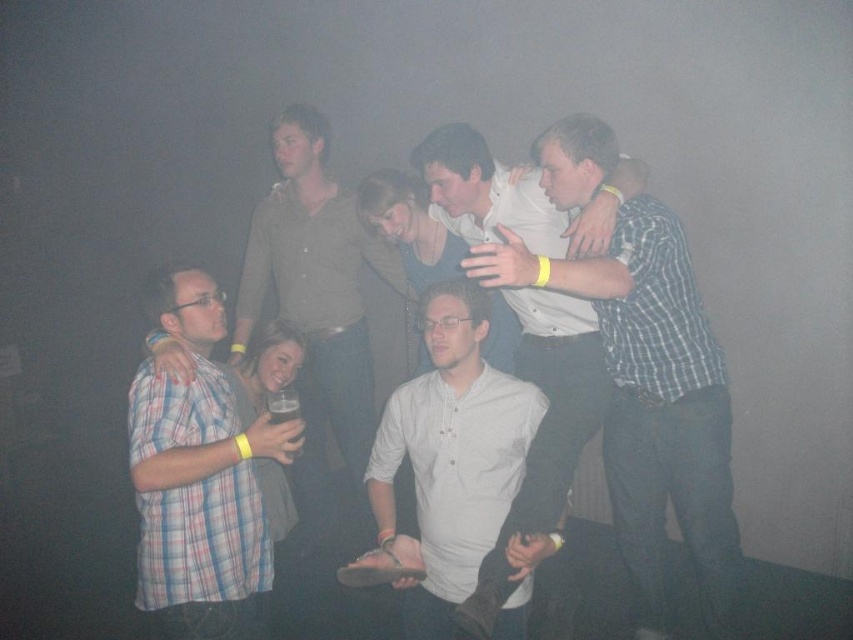
The width and height of the screenshot is (853, 640). What do you see at coordinates (651, 403) in the screenshot? I see `checkered fabric shirt at center` at bounding box center [651, 403].

How distant is checkered fabric shirt at center from plaid shirt at left?

They are 38.81 inches apart.

Which is behind, point (601, 317) or point (241, 612)?

Positioned behind is point (601, 317).

Where is `checkered fabric shirt at center`? The height and width of the screenshot is (640, 853). checkered fabric shirt at center is located at coordinates (651, 403).

Does point (183, 524) come in front of point (482, 452)?

Yes, it is in front of point (482, 452).

Find the location of `plaid shirt at left`. plaid shirt at left is located at coordinates (199, 480).

Who is positioned more to the left, checkered fabric shirt at center or white matte shirt at center?

From the viewer's perspective, white matte shirt at center appears more on the left side.

Is checkered fabric shirt at center above white matte shirt at center?

No, checkered fabric shirt at center is not above white matte shirt at center.

Looking at this image, who is more forward, (628, 236) or (517, 388)?

Point (628, 236) is in front.

In order to click on checkered fabric shirt at center in this screenshot , I will do `click(651, 403)`.